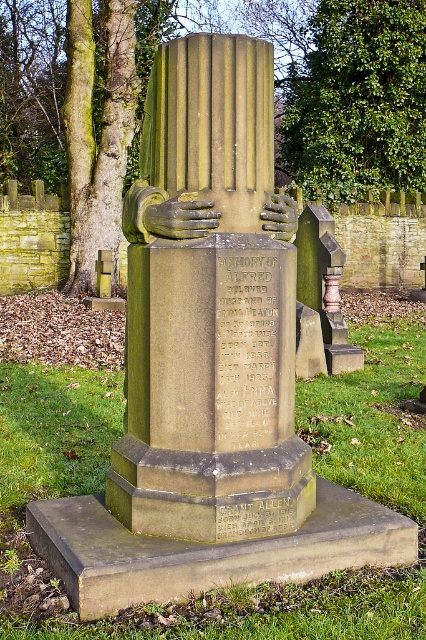
Who is positioned more to the right, green polished stone column at center or green leafy tree at upper center?

green leafy tree at upper center is more to the right.

Between point (236, 230) and point (316, 140), which one is positioned behind?

Point (316, 140)

In order to click on green polished stone column at center in this screenshot , I will do `click(210, 310)`.